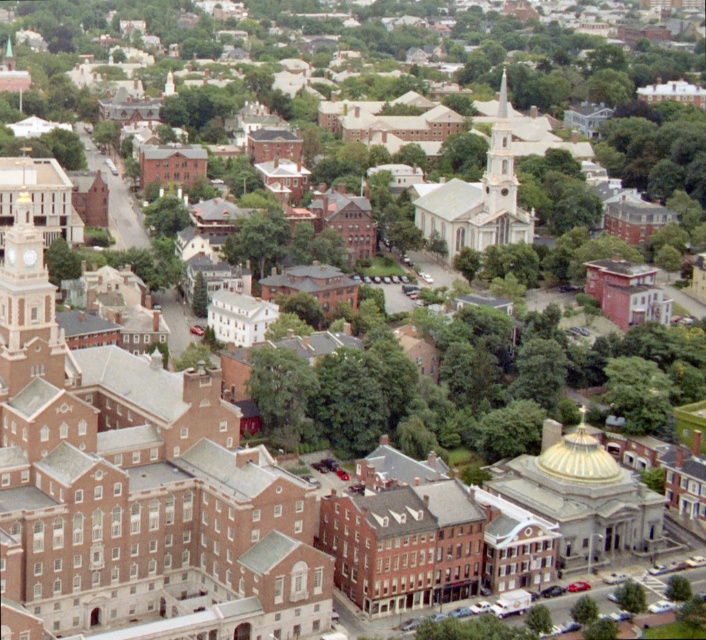
Question: Which object is closer to the camera taking this photo?

Choices:
 (A) matte brick clock tower at left
 (B) green leafy tree at lower right

Answer: (B)

Question: Which object is farther from the camera taking this photo?

Choices:
 (A) green leafy tree at lower right
 (B) matte brick clock tower at left

Answer: (B)

Question: Can you confirm if matte brick clock tower at left is positioned below green leafy tree at lower right?

Choices:
 (A) yes
 (B) no

Answer: (B)

Question: Does matte brick clock tower at left have a larger size compared to green leafy tree at lower right?

Choices:
 (A) no
 (B) yes

Answer: (B)

Question: Which object appears closest to the camera in this image?

Choices:
 (A) green leafy tree at lower right
 (B) matte brick clock tower at left

Answer: (A)

Question: Is matte brick clock tower at left in front of green leafy tree at lower right?

Choices:
 (A) yes
 (B) no

Answer: (B)